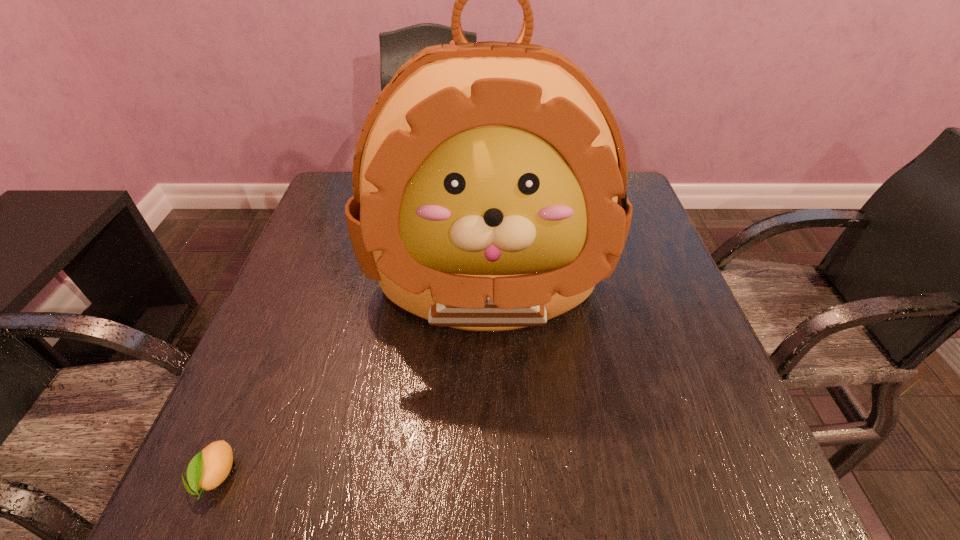
The height and width of the screenshot is (540, 960). What are the coordinates of `blank space at the right edge of the desktop` in the screenshot? It's located at (684, 417).

This screenshot has width=960, height=540. I want to click on vacant space at the far left corner, so click(348, 181).

In the image, there is a desktop. Where is `free space at the far right corner`? The height and width of the screenshot is (540, 960). free space at the far right corner is located at coordinates (636, 220).